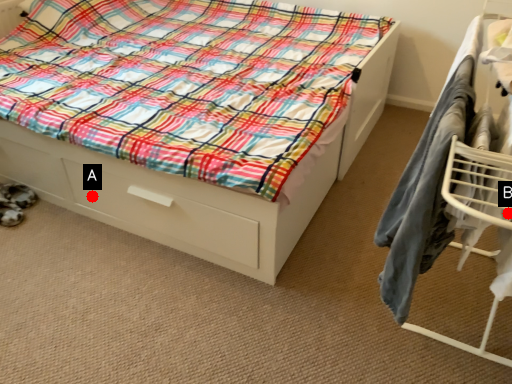
Question: Two points are circled on the image, labeled by A and B beside each circle. Among these points, which one is nearest to the camera?

Choices:
 (A) A is closer
 (B) B is closer

Answer: (B)